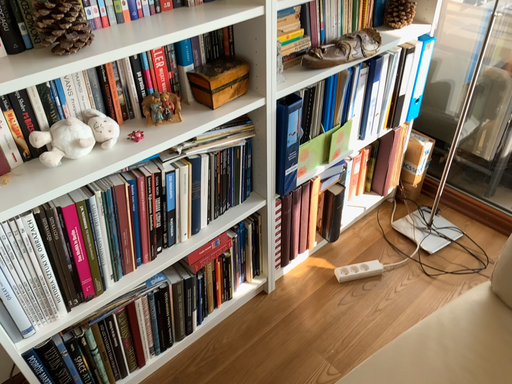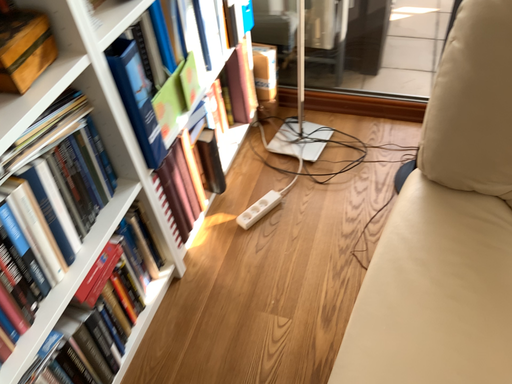
Question: Which way did the camera rotate in the video?

Choices:
 (A) rotated left
 (B) rotated right

Answer: (B)